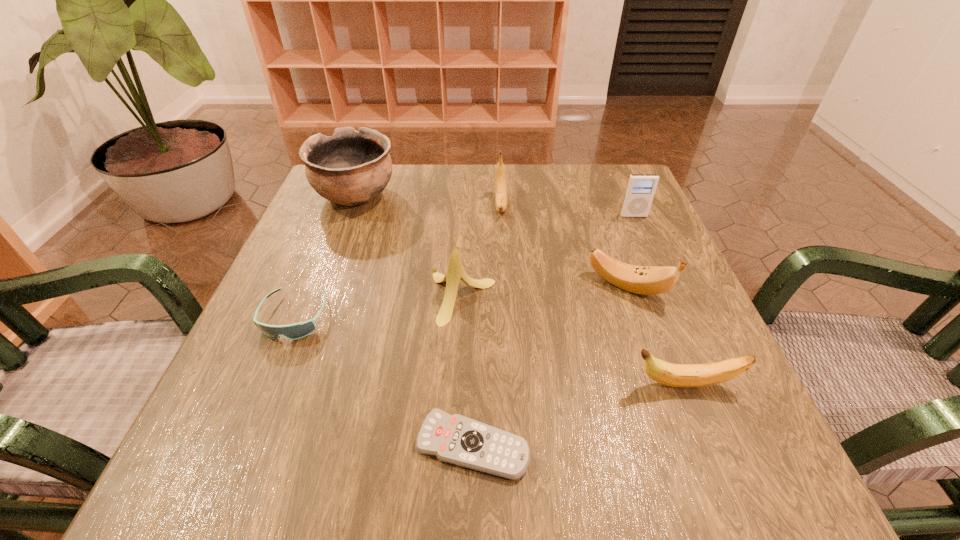
Identify the location of blank space located on the right of the pottery. The image size is (960, 540). point(507,197).

This screenshot has width=960, height=540. Find the location of `free location located at the start of the peel on the third banana from right to left`. free location located at the start of the peel on the third banana from right to left is located at coordinates (511, 359).

The image size is (960, 540). Find the location of `vacant area situated 0.310m on the back of the leftmost banana`. vacant area situated 0.310m on the back of the leftmost banana is located at coordinates (467, 188).

Locate an element on the screen. free spot located on the front-facing side of the iPod is located at coordinates (659, 273).

The height and width of the screenshot is (540, 960). Find the location of `vacant space situated 0.110m on the front of the second shortest banana`. vacant space situated 0.110m on the front of the second shortest banana is located at coordinates (651, 354).

Find the location of a particular element. The height and width of the screenshot is (540, 960). vacant space located 0.160m at the stem of the shortest banana is located at coordinates (527, 384).

Image resolution: width=960 pixels, height=540 pixels. In order to click on blank space located 0.270m at the stem of the shortest banana in this screenshot , I will do `click(457, 384)`.

Identify the location of free space located at the stem of the shortest banana. The image size is (960, 540). (476, 384).

Identify the location of vacant space located 0.130m on the front-facing side of the goggles. The width and height of the screenshot is (960, 540). (255, 413).

Identify the location of vacant space located 0.210m on the left of the remote control. (267, 445).